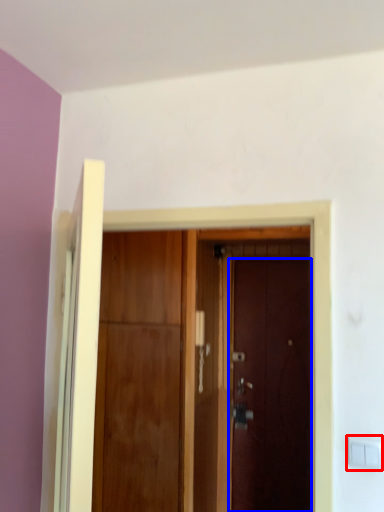
Question: Which object appears closest to the camera in this image, light switch (highlighted by a red box) or door (highlighted by a blue box)?

Choices:
 (A) light switch
 (B) door

Answer: (A)